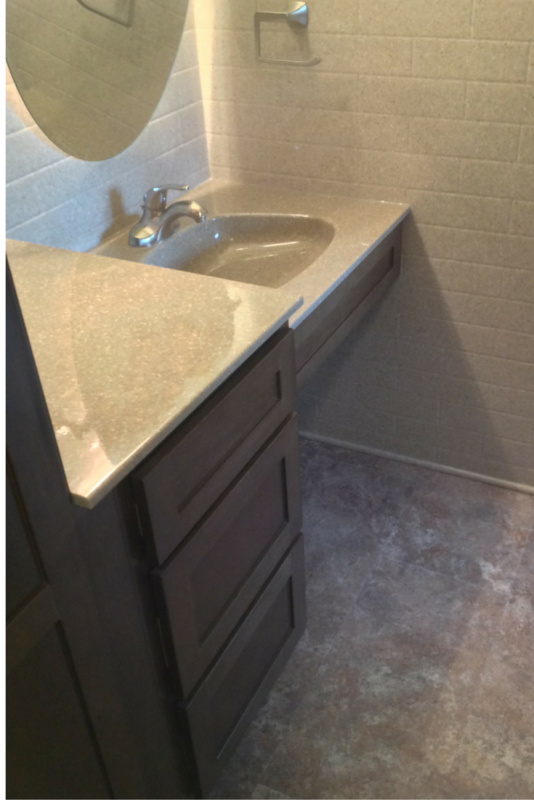
Image resolution: width=534 pixels, height=800 pixels. I want to click on trim, so click(370, 453).